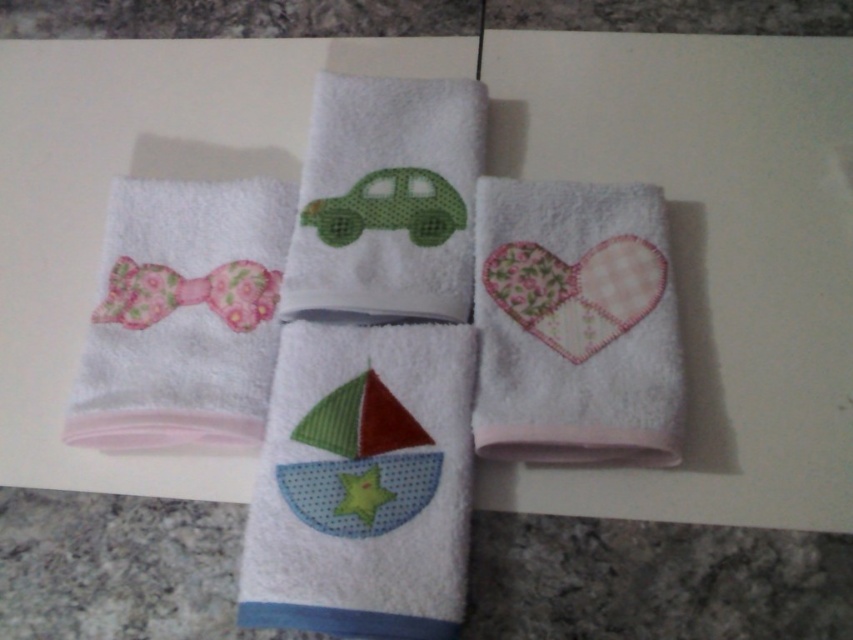
You are organizing a childrens party and have two decorations, a white soft sailboat at center and a patchwork heart at center. Which decoration should you choose if you want the larger one?

The white soft sailboat at center is bigger than the patchwork heart at center, so you should choose the white soft sailboat at center.

You are trying to place a 7.5 inch long decorative item between the white soft sailboat at center and the pink fabric bow at upper left. Will it fit without overlapping either object?

The distance between the white soft sailboat at center and the pink fabric bow at upper left is 7.24 inches. Since the decorative item is 7.5 inches long, it is slightly longer than the available space. Therefore, it will not fit without overlapping one or both objects.

You are organizing towels on a shelf and see the white soft sailboat at center and the pink fabric bow at upper left. Which one is on the right side?

The white soft sailboat at center is positioned on the right side of the pink fabric bow at upper left, so the white soft sailboat at center is on the right.